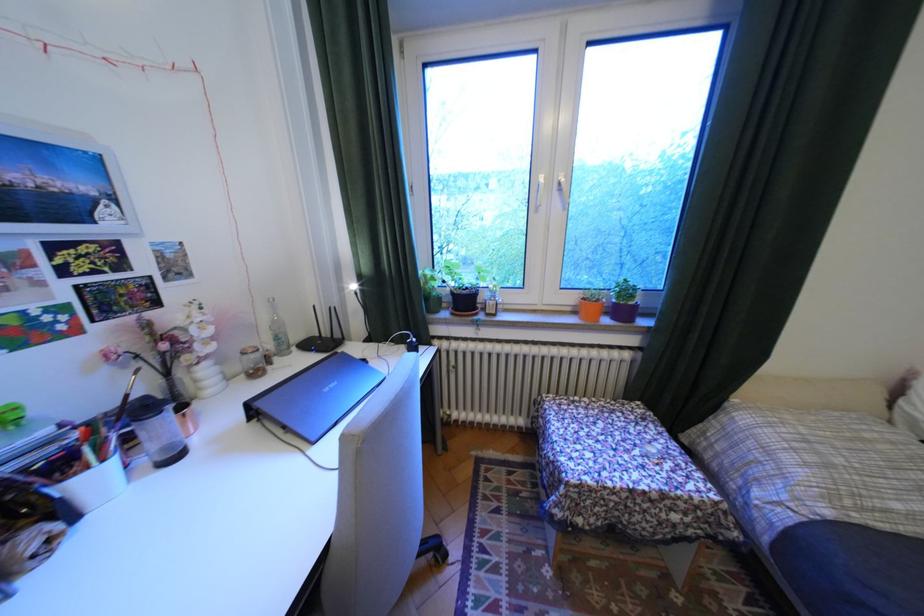
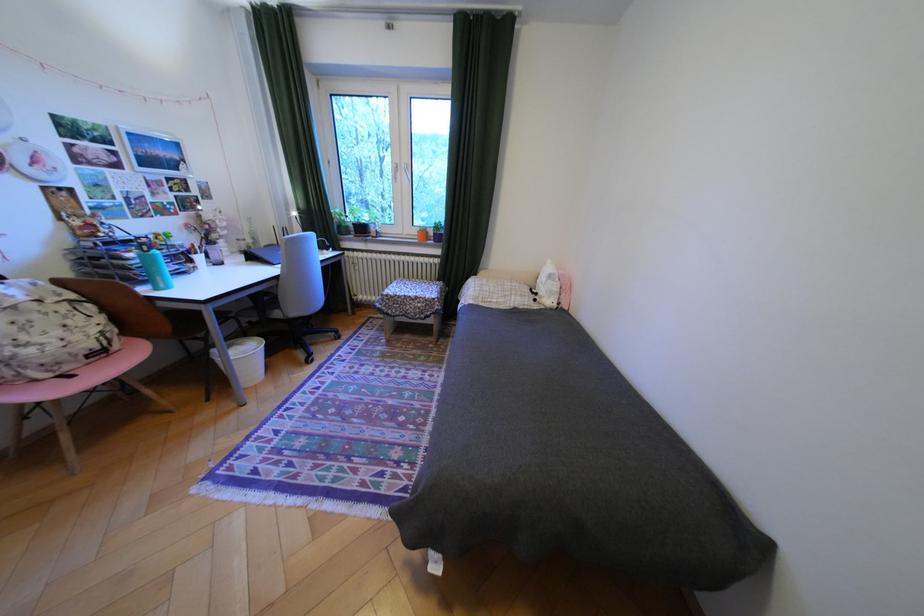
Find the pixel in the second image that matches point 451,299 in the first image.

(359, 227)